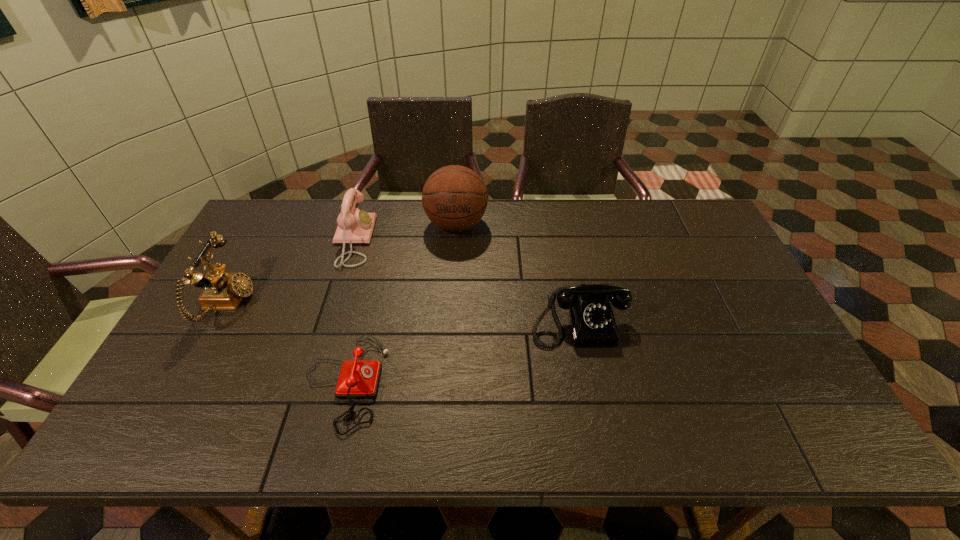
The height and width of the screenshot is (540, 960). I want to click on free space between the basketball and the shortest telephone, so click(x=400, y=303).

Where is `object that is the closest to the fourth shortest object`? Image resolution: width=960 pixels, height=540 pixels. object that is the closest to the fourth shortest object is located at coordinates tap(354, 226).

Point out which object is positioned as the second nearest to the shortest telephone. Please provide its 2D coordinates. Your answer should be formatted as a tuple, i.e. [(x, y)], where the tuple contains the x and y coordinates of a point satisfying the conditions above.

[(354, 226)]

Where is `telephone that stands as the third closest to the leftmost object`? telephone that stands as the third closest to the leftmost object is located at coordinates (592, 323).

I want to click on telephone that is the third closest to the farthest telephone, so click(592, 323).